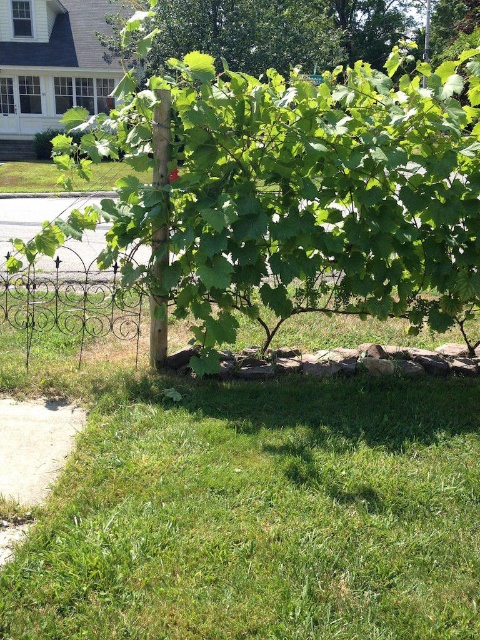
Is green grass at lower left closer to the viewer compared to green leafy tree at center?

Yes, it is.

Which is more to the right, green grass at lower left or green leafy tree at center?

green leafy tree at center

This screenshot has width=480, height=640. I want to click on green grass at lower left, so click(x=257, y=513).

Locate an element on the screen. The width and height of the screenshot is (480, 640). green grass at lower left is located at coordinates (257, 513).